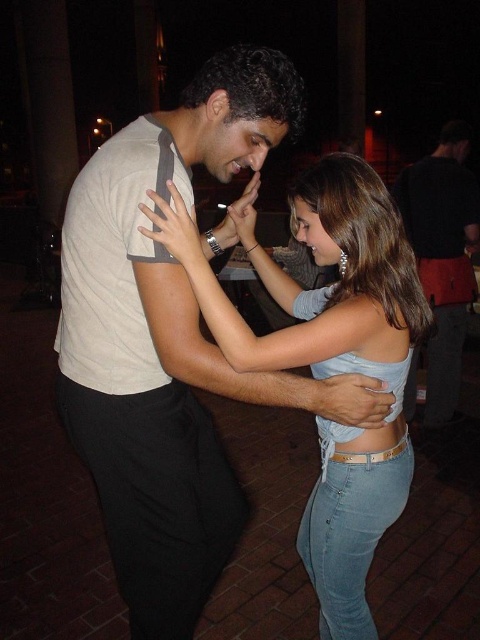
Does light beige t-shirt at center have a lesser width compared to matte black shirt at center?

No, light beige t-shirt at center is not thinner than matte black shirt at center.

Does light beige t-shirt at center come in front of matte black shirt at center?

Yes, light beige t-shirt at center is closer to the viewer.

This screenshot has width=480, height=640. Identify the location of light beige t-shirt at center. (160, 342).

Where is `light beige t-shirt at center`? light beige t-shirt at center is located at coordinates (160, 342).

Is light blue denim jeans at center taller than matte black shirt at center?

No, light blue denim jeans at center is not taller than matte black shirt at center.

Who is positioned more to the right, light blue denim jeans at center or matte black shirt at center?

Positioned to the right is matte black shirt at center.

Who is more forward, (312, 563) or (434, 180)?

Positioned in front is point (312, 563).

In order to click on light blue denim jeans at center in this screenshot , I will do `click(330, 358)`.

This screenshot has width=480, height=640. Identify the location of light beige t-shirt at center. click(x=160, y=342).

Is light beige t-shirt at center below light blue denim jeans at center?

No.

Does point (108, 538) come closer to viewer compared to point (362, 188)?

No, (108, 538) is further to viewer.

Locate an element on the screen. The height and width of the screenshot is (640, 480). light beige t-shirt at center is located at coordinates (160, 342).